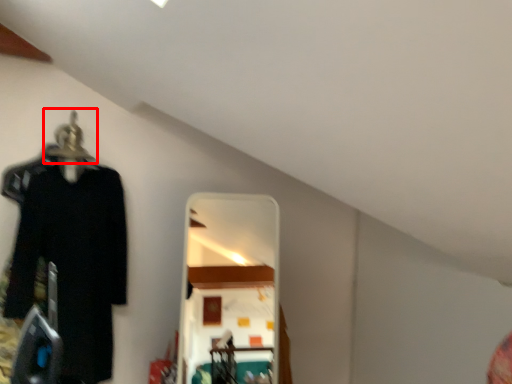
Question: From the image's perspective, considering the relative positions of hanger (annotated by the red box) and clothing in the image provided, where is hanger (annotated by the red box) located with respect to the staircase?

Choices:
 (A) below
 (B) above

Answer: (B)